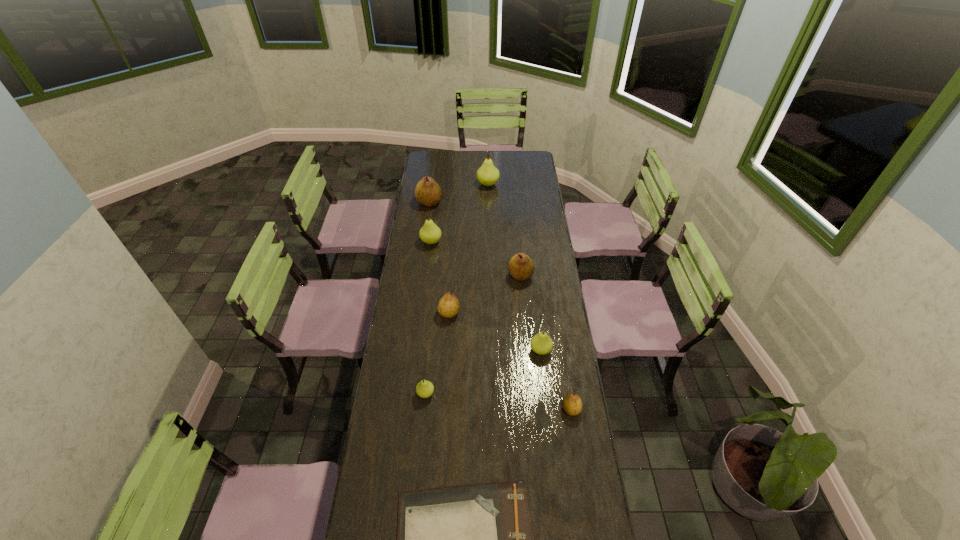
The image size is (960, 540). Identify the location of vacant region located 0.060m on the back of the fourth nearest object. (539, 329).

Identify the location of vacant space located on the back of the nearest green pear. The width and height of the screenshot is (960, 540). (432, 327).

Find the location of a particular element. free space located on the back of the rightmost object is located at coordinates (565, 376).

Locate an element on the screen. The image size is (960, 540). vacant space at the far edge of the desktop is located at coordinates (510, 165).

What are the coordinates of `free space at the left edge` in the screenshot? It's located at (412, 286).

Find the location of a particular element. This screenshot has height=540, width=960. vacant space at the right edge of the desktop is located at coordinates (537, 230).

At what (x,y) coordinates should I click in order to perform the action: click on vacant space at the far left corner. Please return your answer as a coordinate pair (x, y). Looking at the image, I should click on (444, 160).

Where is `vacant region between the nearest green pear and the sixth nearest pear`? The image size is (960, 540). vacant region between the nearest green pear and the sixth nearest pear is located at coordinates (428, 318).

The width and height of the screenshot is (960, 540). Identify the location of vacant area that lies between the second biggest green pear and the second green pear from right to left. (460, 213).

The image size is (960, 540). What are the coordinates of `free spot between the second farthest pear and the second brown pear from right to left` in the screenshot? It's located at (475, 239).